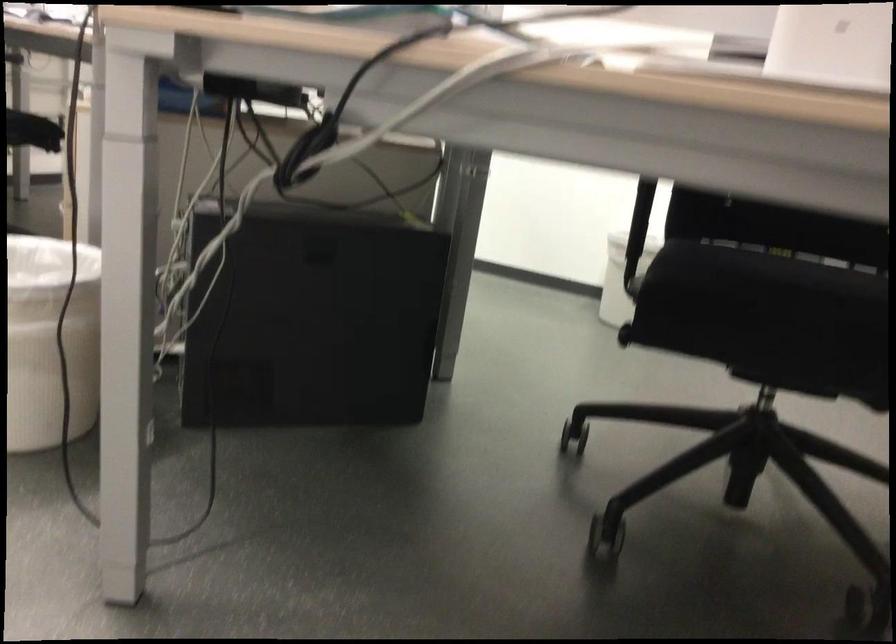
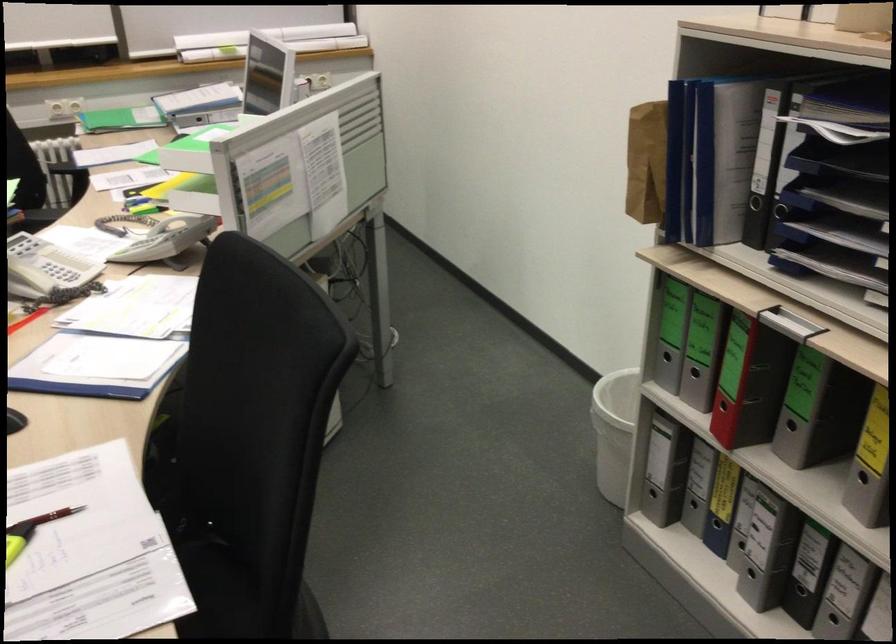
Find the pixel in the second image that matches pixel 736 245 in the first image.

(208, 581)